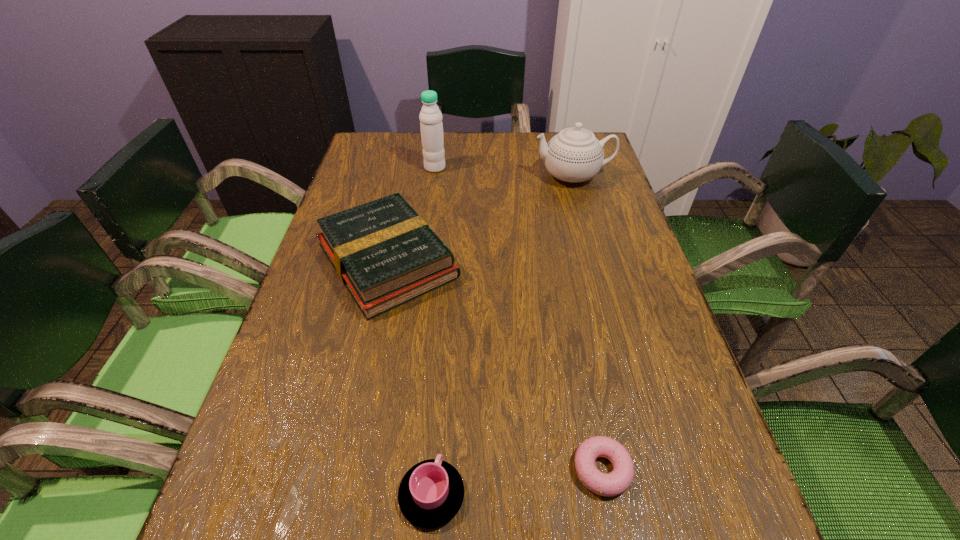
I want to click on object that is at the far right corner, so click(x=574, y=155).

Locate an element on the screen. This screenshot has height=540, width=960. free spot at the far edge of the desktop is located at coordinates (x=448, y=132).

Where is `vacant space at the left edge`? vacant space at the left edge is located at coordinates (348, 200).

What are the coordinates of `vacant space at the right edge of the desktop` in the screenshot? It's located at (632, 274).

The height and width of the screenshot is (540, 960). I want to click on vacant region at the far left corner of the desktop, so click(369, 156).

Locate an element on the screen. The image size is (960, 540). vacant area that lies between the fourth tallest object and the tallest object is located at coordinates (433, 332).

The width and height of the screenshot is (960, 540). In order to click on free space between the cup and the water bottle in this screenshot , I will do `click(433, 332)`.

Locate an element on the screen. This screenshot has height=540, width=960. free spot between the doughnut and the third tallest object is located at coordinates (495, 365).

This screenshot has width=960, height=540. Identify the location of free space between the shortest object and the hardback book. (495, 365).

Image resolution: width=960 pixels, height=540 pixels. I want to click on vacant region between the hardback book and the shortest object, so click(495, 365).